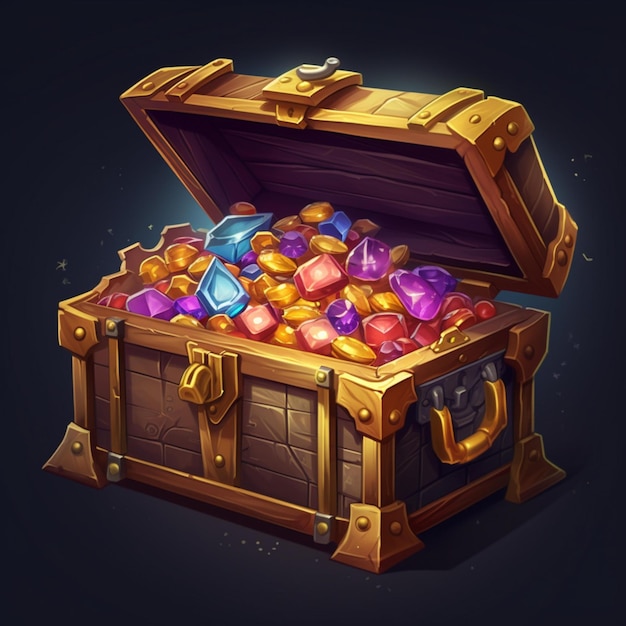
Image resolution: width=626 pixels, height=626 pixels. In order to click on hinge in this screenshot , I will do 476,290.